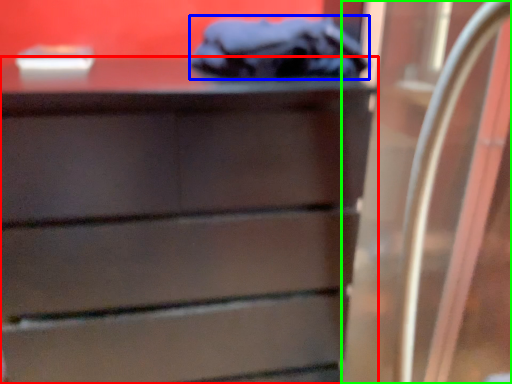
Question: Which is farther away from chest of drawers (highlighted by a red box)? scrub (highlighted by a blue box) or glass door (highlighted by a green box)?

Choices:
 (A) scrub
 (B) glass door

Answer: (B)